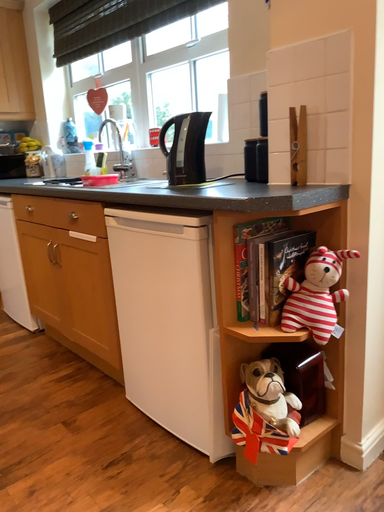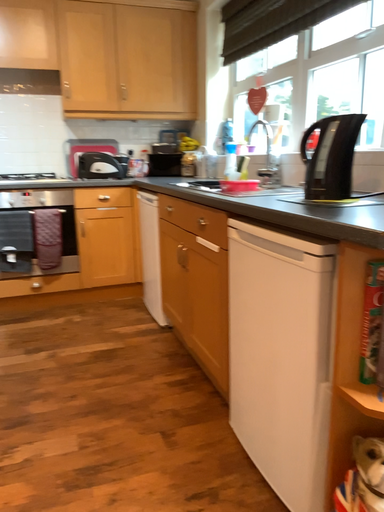
Question: How did the camera likely rotate when shooting the video?

Choices:
 (A) rotated left
 (B) rotated right

Answer: (A)